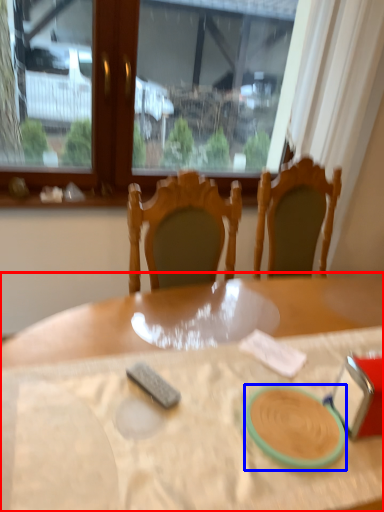
Question: Which point is closer to the camera, table (highlighted by a red box) or tableware (highlighted by a blue box)?

Choices:
 (A) table
 (B) tableware

Answer: (A)